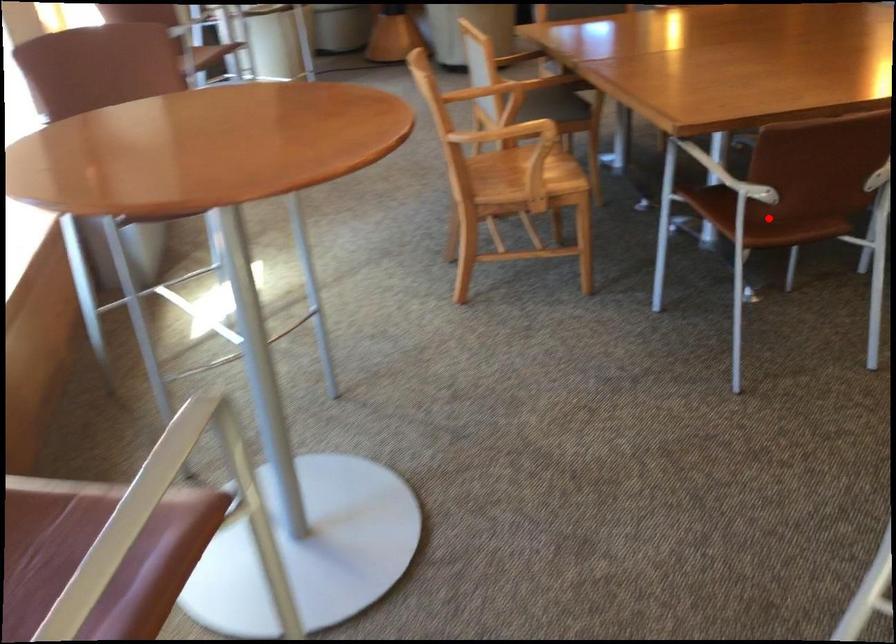
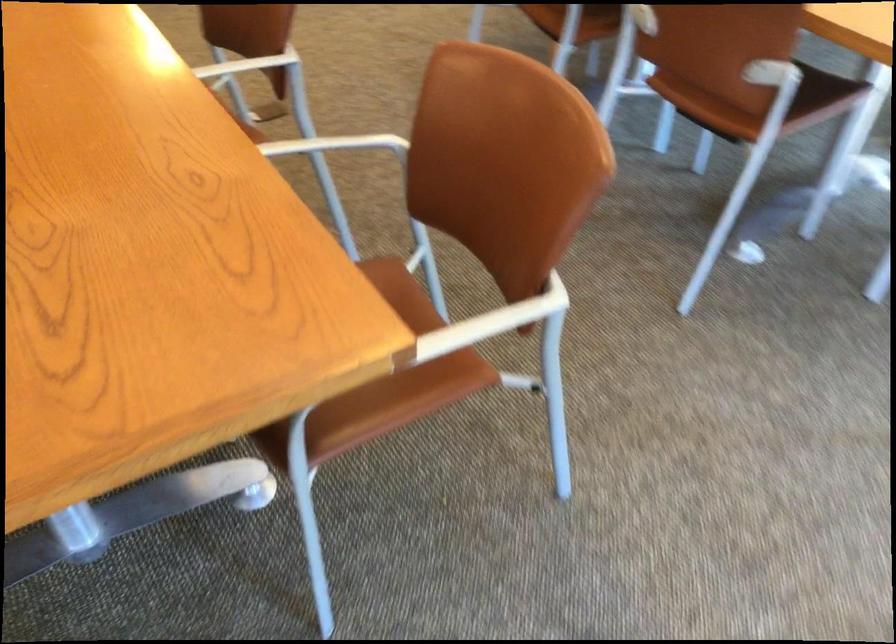
Question: I am providing you with two images of the same scene from different viewpoints. A red point is marked on the first image. Can you still see the location of the red point in image 2?

Choices:
 (A) Yes
 (B) No

Answer: (B)